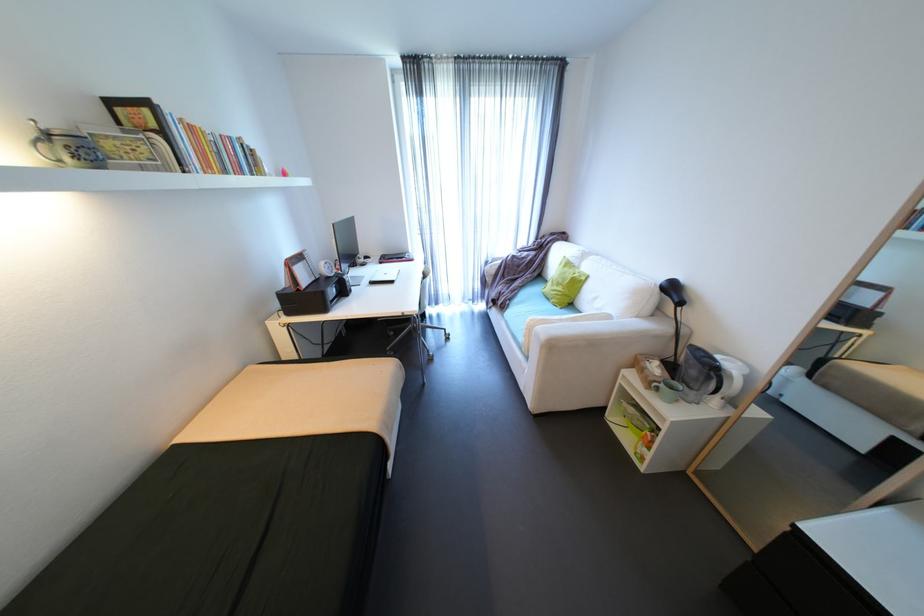
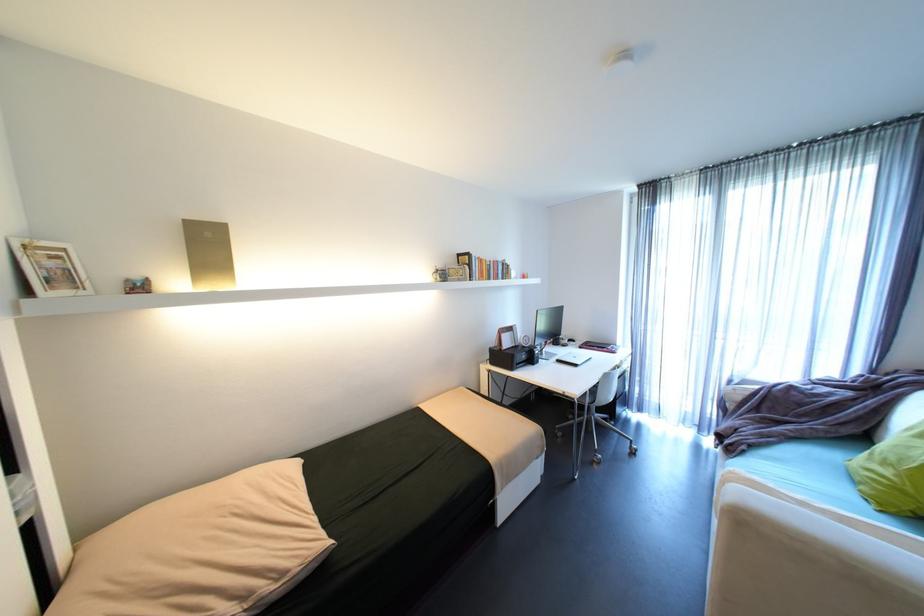
Where in the second image is the point corresponding to [227,136] from the first image?

(500, 262)